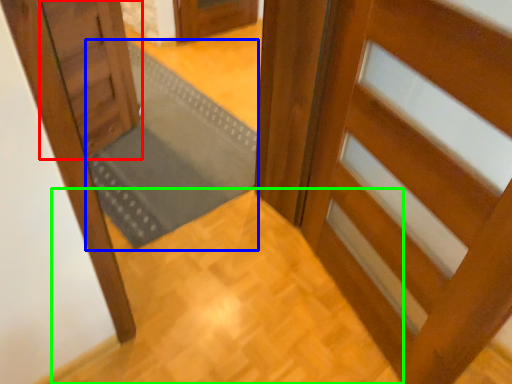
Question: Based on their relative distances, which object is farther from door (highlighted by a red box)? Choose from doormat (highlighted by a blue box) and path (highlighted by a green box).

Choices:
 (A) doormat
 (B) path

Answer: (B)